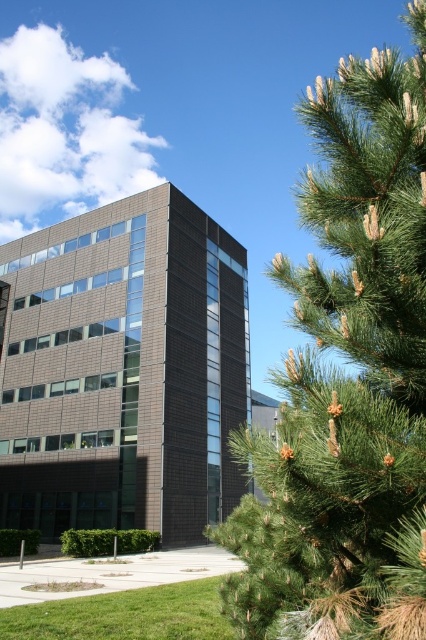
Question: From the image, what is the correct spatial relationship of green needle-like at right in relation to brown brick building at center?

Choices:
 (A) left
 (B) right

Answer: (B)

Question: Can you confirm if green needle-like at right is smaller than brown brick building at center?

Choices:
 (A) yes
 (B) no

Answer: (A)

Question: Which point is closer to the camera?

Choices:
 (A) brown brick building at center
 (B) green needle-like at right

Answer: (B)

Question: Which object is closer to the camera taking this photo?

Choices:
 (A) green needle-like at right
 (B) brown brick building at center

Answer: (A)

Question: Is green needle-like at right positioned at the back of brown brick building at center?

Choices:
 (A) yes
 (B) no

Answer: (B)